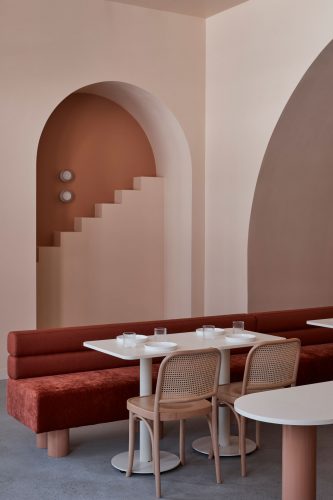
Find the location of a particular element. wall is located at coordinates 121,148.